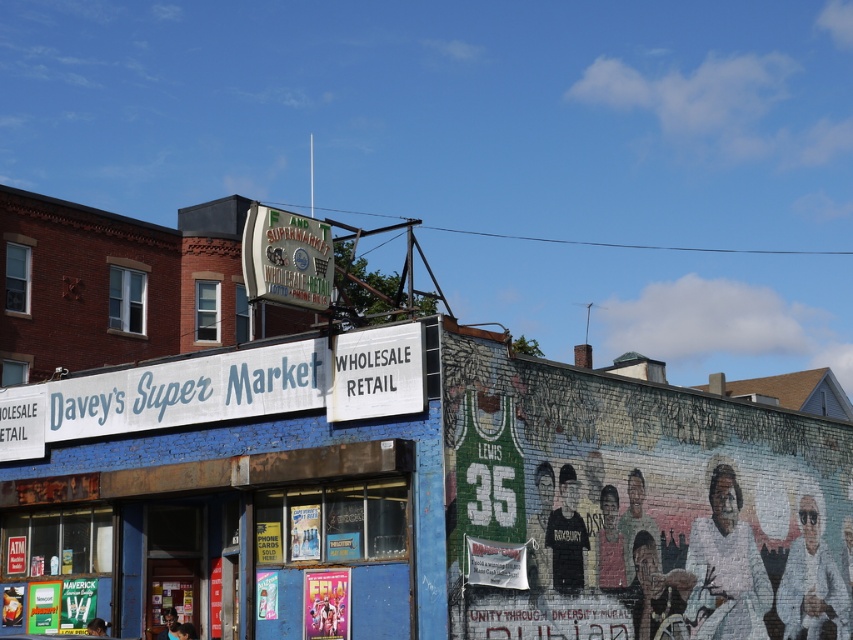
Question: Which object appears farthest from the camera in this image?

Choices:
 (A) painted brick mural at right
 (B) blue painted brick davey's super market at center

Answer: (A)

Question: Which is nearer to the blue painted brick davey's super market at center?

Choices:
 (A) painted brick mural at right
 (B) white painted wood sign at upper center

Answer: (B)

Question: Does painted brick mural at right have a lesser width compared to white painted wood sign at upper center?

Choices:
 (A) yes
 (B) no

Answer: (B)

Question: Does painted brick mural at right have a greater width compared to white painted wood sign at upper center?

Choices:
 (A) yes
 (B) no

Answer: (A)

Question: In this image, where is painted brick mural at right located relative to white painted wood sign at upper center?

Choices:
 (A) above
 (B) below

Answer: (B)

Question: Which object appears farthest from the camera in this image?

Choices:
 (A) blue painted brick davey's super market at center
 (B) painted brick mural at right
 (C) white painted wood sign at upper center

Answer: (C)